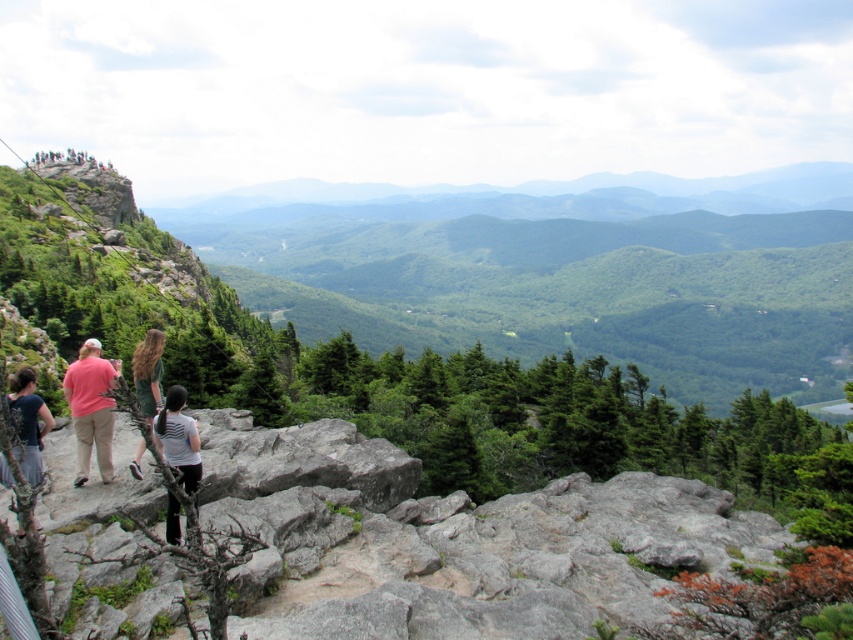
You are a photographer at the scenic overlook. You want to capture a photo that includes both the matte pink shirt at left and the white matte shirt at center. Which shirt should you focus on first to ensure both are in frame?

You should focus on the matte pink shirt at left first because it is taller than the white matte shirt at center, so adjusting the camera angle to include its height will naturally include the shorter one as well.

You are a photographer at the overlook and want to capture both the matte pink shirt at left and the white matte shirt at center in your shot. Which shirt will appear smaller in the photo?

The matte pink shirt at left will appear smaller in the photo because it has a smaller size compared to the white matte shirt at center.

You are a photographer at the scenic overlook. You want to capture a photo that includes both the matte pink shirt at left and the green fabric dress at center. Based on their positions, which subject should you focus on first to ensure both are in the frame?

The matte pink shirt at left is above the green fabric dress at center, so you should focus on the matte pink shirt at left first to ensure both are in the frame.